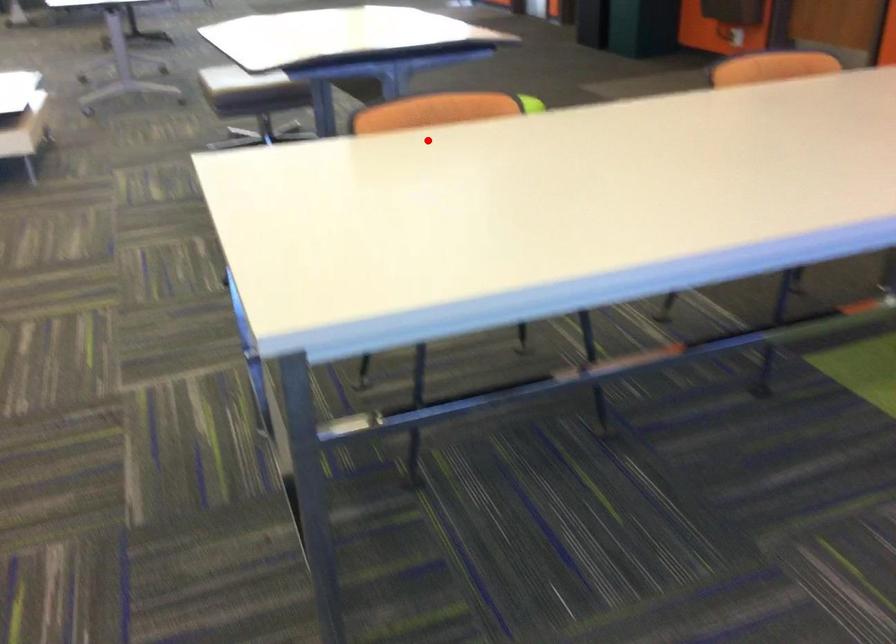
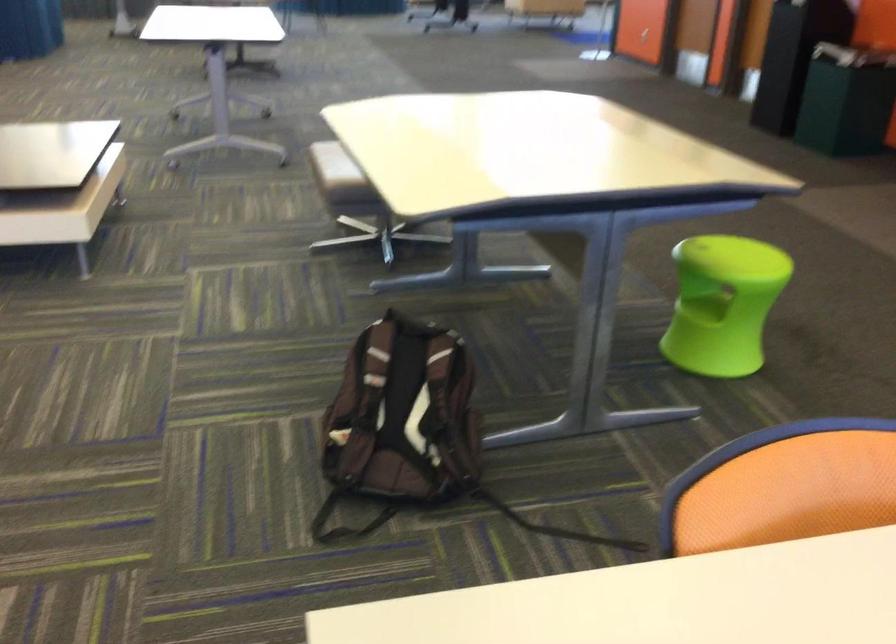
Question: I am providing you with two images of the same scene from different viewpoints. Image1 has a red point marked. In image2, the corresponding 3D location appears at what relative position? Reply with the corresponding letter.

Choices:
 (A) Closer
 (B) Farther

Answer: (A)